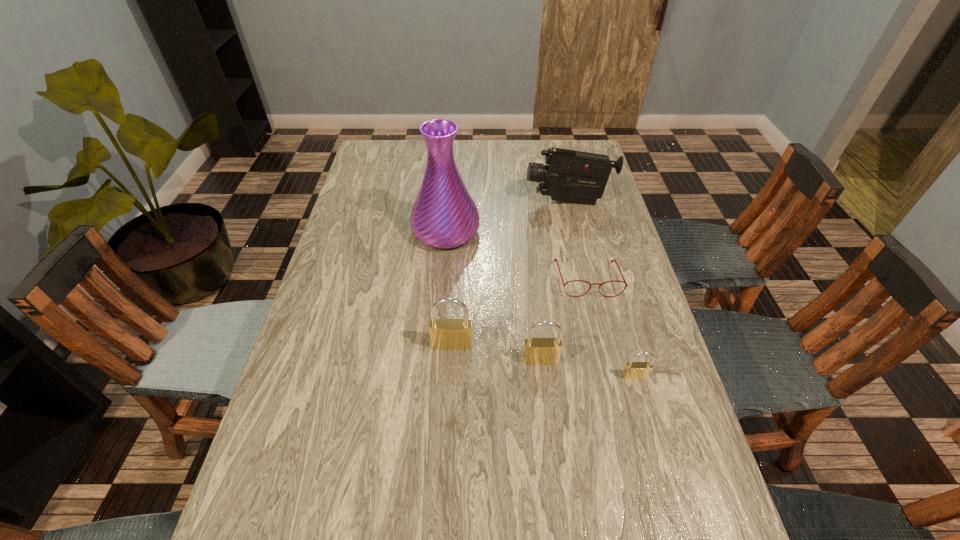
Where is `the shortest object`? the shortest object is located at coordinates (555, 259).

The height and width of the screenshot is (540, 960). I want to click on vacant region located 0.130m on the front-facing side of the leftmost padlock, so click(449, 397).

Identify the location of blank space located 0.280m on the front-facing side of the second farthest padlock. (555, 485).

Where is `free space located on the front-facing side of the shortest padlock`? free space located on the front-facing side of the shortest padlock is located at coordinates (653, 442).

Where is `vacant area situated 0.070m on the front of the tallest object`? vacant area situated 0.070m on the front of the tallest object is located at coordinates (443, 271).

What are the coordinates of `free space located on the front-facing side of the farthest object` in the screenshot? It's located at (479, 201).

Locate an element on the screen. The width and height of the screenshot is (960, 540). free spot located 0.160m on the front-facing side of the farthest object is located at coordinates (479, 201).

I want to click on free space located on the front-facing side of the farthest object, so click(x=413, y=201).

Locate an element on the screen. This screenshot has width=960, height=540. free space located 0.220m on the face of the spectacles is located at coordinates (608, 365).

Locate an element on the screen. padlock present at the right edge is located at coordinates (633, 370).